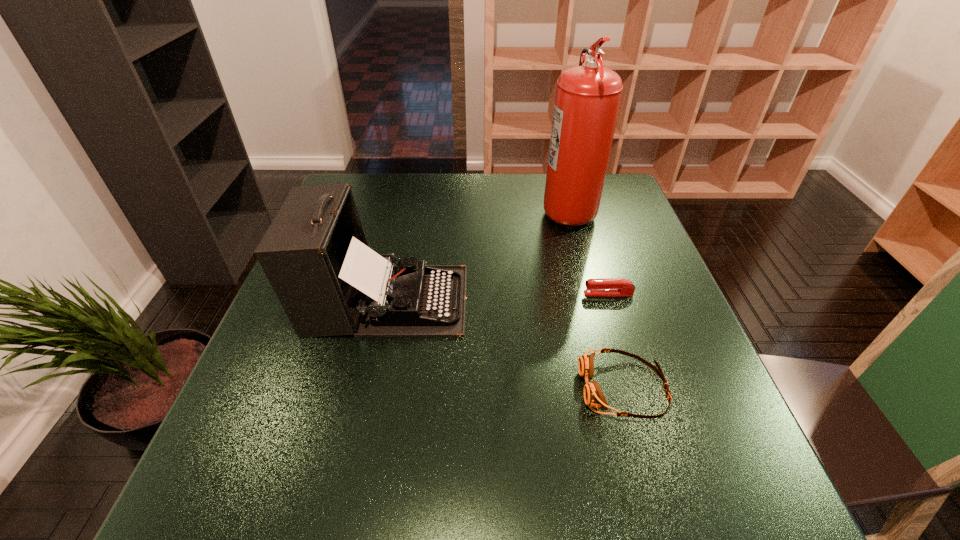
Image resolution: width=960 pixels, height=540 pixels. In order to click on the tallest object in this screenshot , I will do `click(587, 100)`.

Locate an element on the screen. This screenshot has width=960, height=540. the farthest object is located at coordinates (587, 100).

Where is `typewriter`? The height and width of the screenshot is (540, 960). typewriter is located at coordinates tap(315, 254).

Where is `the second tallest object`? the second tallest object is located at coordinates point(315,254).

Locate an element on the screen. the second shortest object is located at coordinates (593, 396).

You are a GUI agent. You are given a task and a screenshot of the screen. Output one action in this format:
    pyautogui.click(x=<x>, y=<y>)
    Task: Click on the nearest object
    The image size is (960, 540).
    Given the screenshot: What is the action you would take?
    pyautogui.click(x=593, y=396)

Find the location of a particular element. the shortest object is located at coordinates (604, 286).

Identify the location of free region located 0.050m on the instruction side of the farthest object. (524, 208).

At what (x,y) coordinates should I click in order to perform the action: click on vacant space located 0.110m on the instruction side of the farthest object. Please return your answer as a coordinate pair (x, y). The height and width of the screenshot is (540, 960). Looking at the image, I should click on (505, 208).

Image resolution: width=960 pixels, height=540 pixels. I want to click on vacant space located on the instruction side of the farthest object, so click(x=441, y=208).